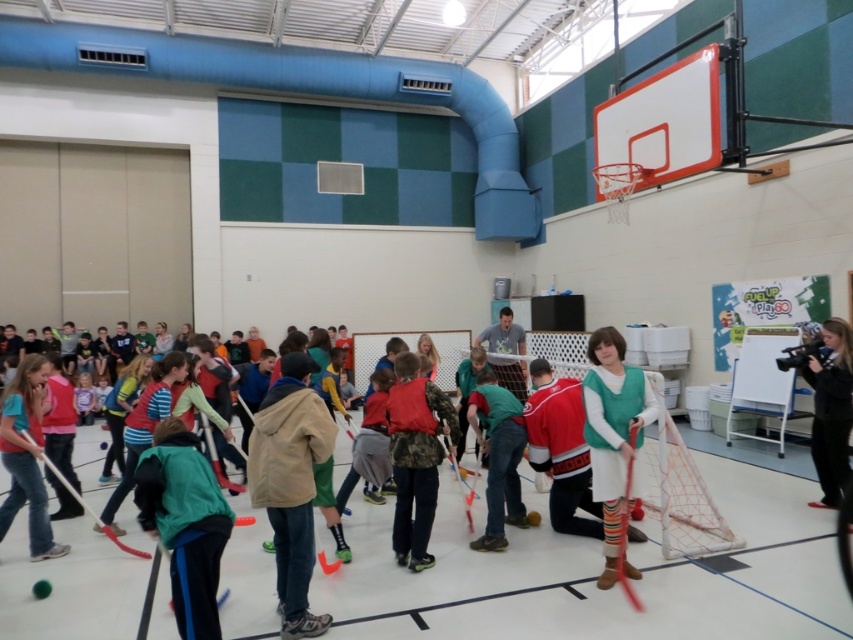
Can you confirm if black fabric camera at right is wider than rubber hockey stick at center?

No, black fabric camera at right is not wider than rubber hockey stick at center.

Between black fabric camera at right and rubber hockey stick at center, which one is positioned lower?

rubber hockey stick at center is lower down.

Describe the element at coordinates (831, 410) in the screenshot. This screenshot has height=640, width=853. I see `black fabric camera at right` at that location.

Identify the location of black fabric camera at right. The width and height of the screenshot is (853, 640). (831, 410).

Is tan fabric jacket at center shorter than rubber hockey stick at center?

No, tan fabric jacket at center is not shorter than rubber hockey stick at center.

Does tan fabric jacket at center have a lesser width compared to rubber hockey stick at center?

Indeed, tan fabric jacket at center has a lesser width compared to rubber hockey stick at center.

Image resolution: width=853 pixels, height=640 pixels. I want to click on tan fabric jacket at center, so click(x=289, y=484).

The image size is (853, 640). What are the coordinates of `tan fabric jacket at center` in the screenshot? It's located at (289, 484).

Which is above, green matte vest at center or light blue jersey at center?

green matte vest at center is above.

Locate an element on the screen. The width and height of the screenshot is (853, 640). green matte vest at center is located at coordinates (612, 433).